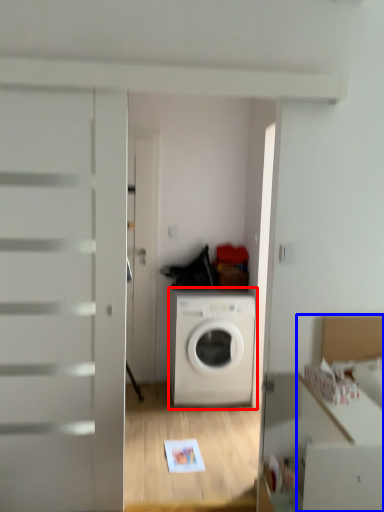
Question: Which of the following is the closest to the observer, washing machine (highlighted by a red box) or cabinetry (highlighted by a blue box)?

Choices:
 (A) washing machine
 (B) cabinetry

Answer: (B)